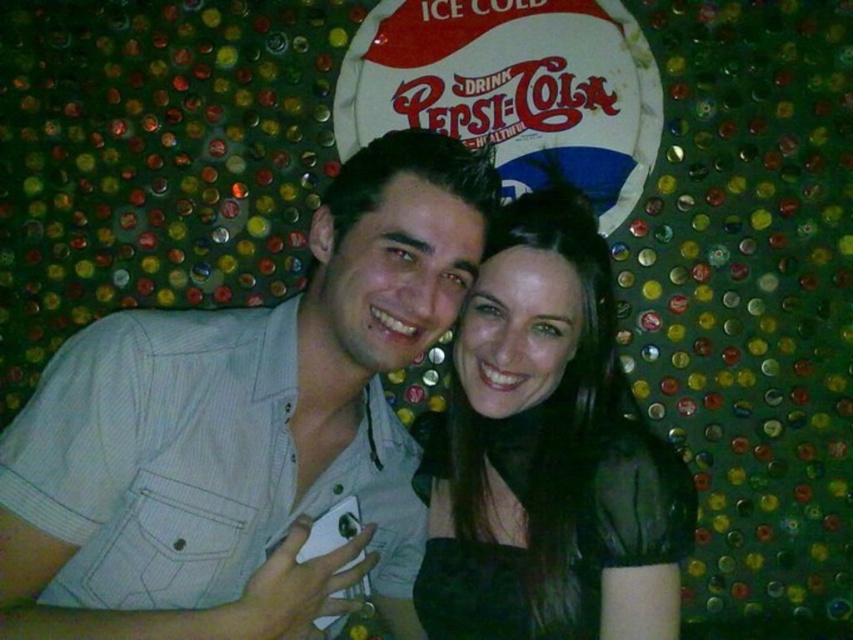
Question: Is light gray striped shirt at center positioned at the back of black sheer top at center?

Choices:
 (A) yes
 (B) no

Answer: (B)

Question: Among these points, which one is farthest from the camera?

Choices:
 (A) (459, 624)
 (B) (416, 173)

Answer: (A)

Question: Is the position of light gray striped shirt at center more distant than that of black sheer top at center?

Choices:
 (A) yes
 (B) no

Answer: (B)

Question: Among these points, which one is nearest to the camera?

Choices:
 (A) (86, 339)
 (B) (538, 388)

Answer: (A)

Question: Is the position of light gray striped shirt at center more distant than that of black sheer top at center?

Choices:
 (A) no
 (B) yes

Answer: (A)

Question: Which point is farther to the camera?

Choices:
 (A) black sheer top at center
 (B) light gray striped shirt at center

Answer: (A)